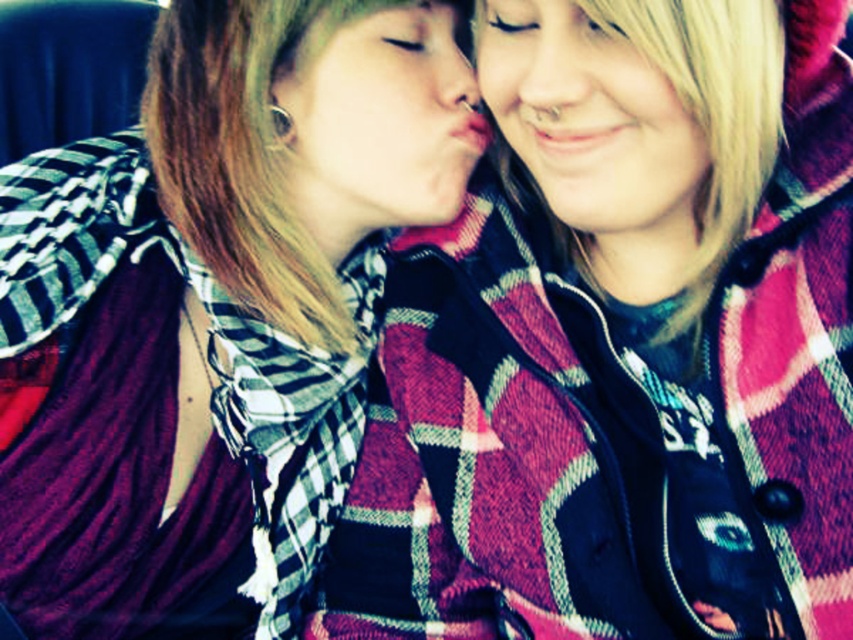
You are a photographer adjusting the focus on your camera. You need to ensure that the plaid fabric jacket at center is in sharp focus. Given that the focus point is currently set to point [606,419], which object should you focus on?

The plaid fabric jacket at center is represented by point [606,419], so you should focus on the plaid fabric jacket at center to ensure it is in sharp focus.

You are a photographer trying to capture the perfect shot of the plaid fabric shirt at center and the blonde hair at upper right. Which object is located to the left of the other?

The plaid fabric shirt at center is positioned on the left side of blonde hair at upper right.

You are a photographer trying to capture a close shot of the plaid fabric jacket at center and the blonde hair at upper right. Which object should you focus on first to ensure it appears sharp in the photo?

The plaid fabric jacket at center is closer to the viewer than the blonde hair at upper right, so you should focus on the plaid fabric jacket at center first to ensure it appears sharp.